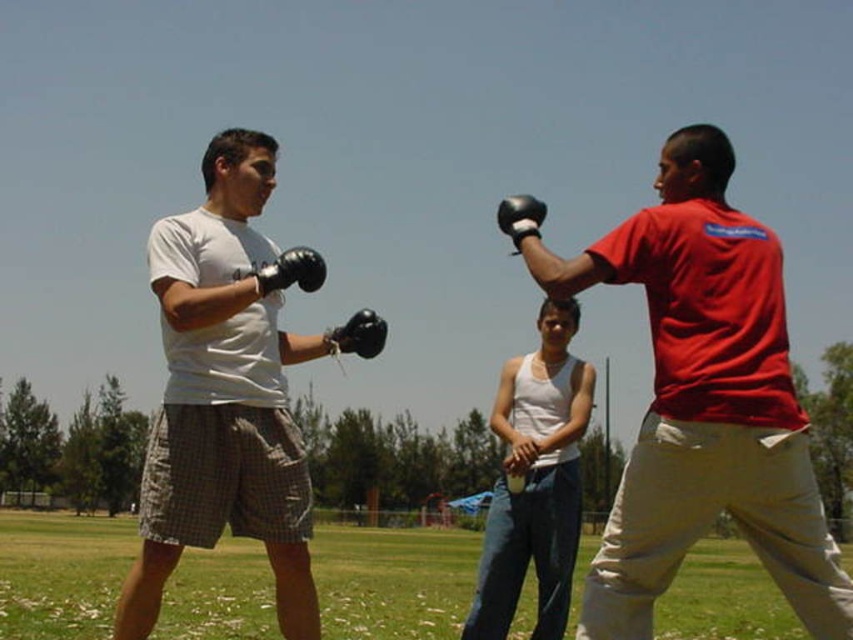
Who is taller, white tank top at center or black matte boxing glove at center?

With more height is white tank top at center.

Describe the element at coordinates (535, 481) in the screenshot. The width and height of the screenshot is (853, 640). I see `white tank top at center` at that location.

Which is in front, point (492, 634) or point (334, 328)?

Point (334, 328)

The width and height of the screenshot is (853, 640). Find the location of `white tank top at center`. white tank top at center is located at coordinates (535, 481).

Is black matte boxing glove at center to the right of black matte boxing glove at upper right from the viewer's perspective?

No, black matte boxing glove at center is not to the right of black matte boxing glove at upper right.

You are a GUI agent. You are given a task and a screenshot of the screen. Output one action in this format:
    pyautogui.click(x=<x>, y=<y>)
    Task: Click on the black matte boxing glove at center
    
    Given the screenshot: What is the action you would take?
    pyautogui.click(x=360, y=333)

Locate an element on the screen. black matte boxing glove at center is located at coordinates (360, 333).

Is matte black boxing glove at upper right to the right of white tank top at center from the viewer's perspective?

Correct, you'll find matte black boxing glove at upper right to the right of white tank top at center.

Which of these two, matte black boxing glove at upper right or white tank top at center, stands taller?

white tank top at center

Between point (703, 180) and point (544, 532), which one is positioned in front?

Point (703, 180)

You are a GUI agent. You are given a task and a screenshot of the screen. Output one action in this format:
    pyautogui.click(x=<x>, y=<y>)
    Task: Click on the matte black boxing glove at upper right
    
    Given the screenshot: What is the action you would take?
    pyautogui.click(x=704, y=401)